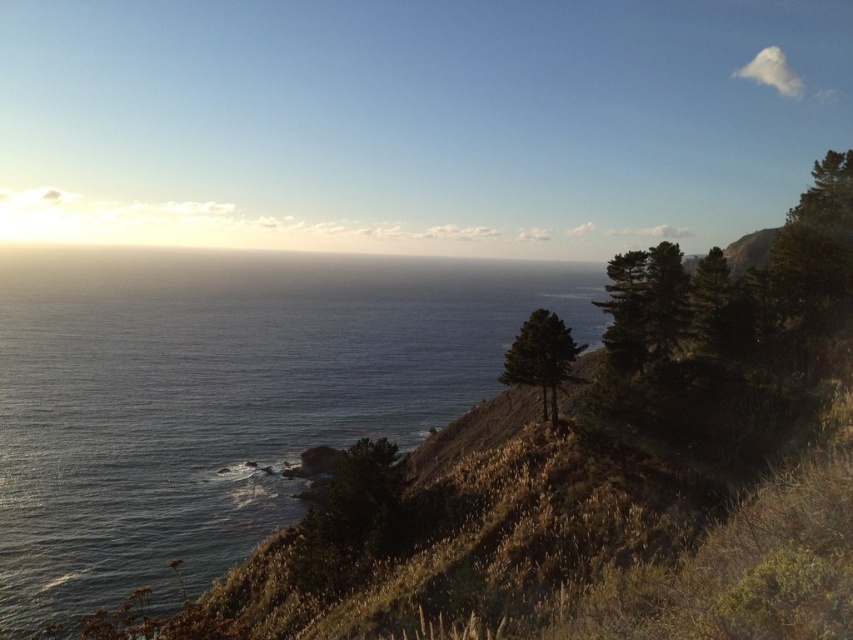
Which is above, blue water at center or green leafy tree at upper right?

blue water at center is higher up.

Where is `blue water at center`? The image size is (853, 640). blue water at center is located at coordinates (219, 396).

Image resolution: width=853 pixels, height=640 pixels. What are the coordinates of `blue water at center` in the screenshot? It's located at (219, 396).

Is green leafy tree at upper right to the right of green leafy tree at center from the viewer's perspective?

Indeed, green leafy tree at upper right is positioned on the right side of green leafy tree at center.

Is green leafy tree at upper right closer to camera compared to green leafy tree at center?

Yes.

I want to click on green leafy tree at upper right, so click(x=817, y=244).

Is blue water at center bigger than green leafy tree at center?

Yes, blue water at center is bigger than green leafy tree at center.

Between blue water at center and green leafy tree at center, which one is positioned lower?

green leafy tree at center is below.

The width and height of the screenshot is (853, 640). Identify the location of blue water at center. (219, 396).

This screenshot has width=853, height=640. Identify the location of blue water at center. (219, 396).